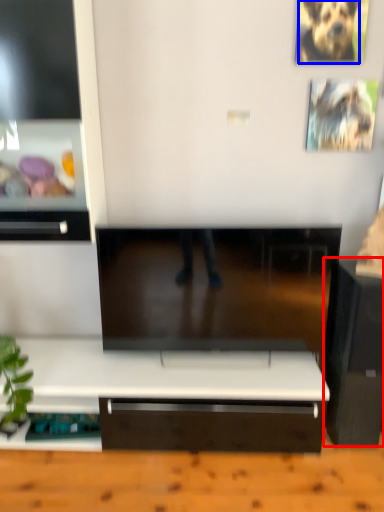
Question: Which point is further to the camera, furniture (highlighted by a red box) or animal (highlighted by a blue box)?

Choices:
 (A) furniture
 (B) animal

Answer: (B)